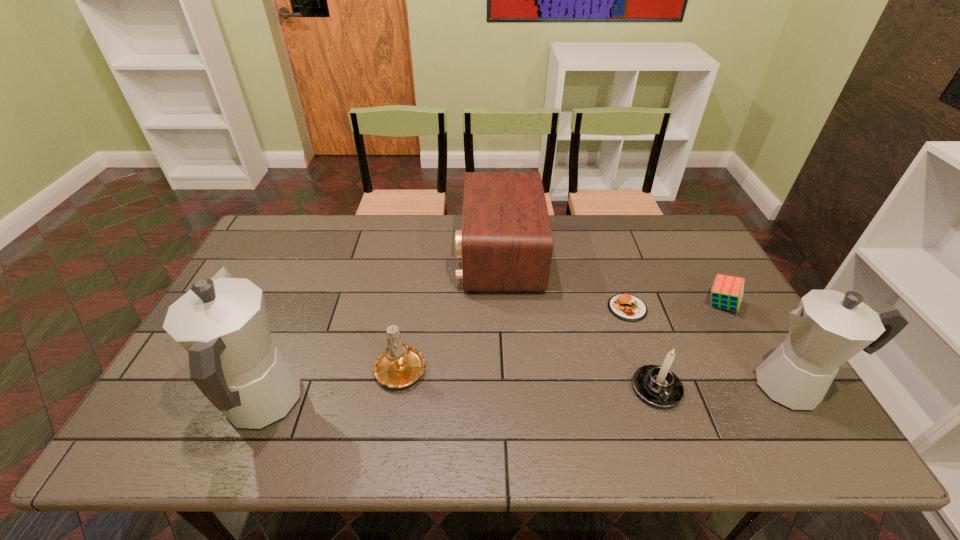
You are a GUI agent. You are given a task and a screenshot of the screen. Output one action in this format:
    pyautogui.click(x=<x>, y=<y>)
    Task: Click on the blank region between the candle holder and the sixth shortest object
    
    Given the screenshot: What is the action you would take?
    pyautogui.click(x=725, y=387)

Locate an element on the screen. The height and width of the screenshot is (540, 960). free spot between the shorter coffeepot and the candle holder is located at coordinates (725, 387).

Choose which object is the nearest neighbor to the shortest object. Please provide its 2D coordinates. Your answer should be formatted as a tuple, i.e. [(x, y)], where the tuple contains the x and y coordinates of a point satisfying the conditions above.

[(657, 385)]

Identify which object is located as the fourth nearest to the fifth object from right to left. Please provide its 2D coordinates. Your answer should be formatted as a tuple, i.e. [(x, y)], where the tuple contains the x and y coordinates of a point satisfying the conditions above.

[(222, 322)]

Find the location of a particular element. free space that satisfies the following two spatial constraints: 1. on the front panel of the fifth object from right to left; 2. on the right side of the right coffeepot is located at coordinates (506, 386).

The image size is (960, 540). What are the coordinates of `vacant region that satisfies the following two spatial constraints: 1. on the front panel of the patty (food); 2. on the left side of the third object from left to right` in the screenshot? It's located at (502, 308).

Locate an element on the screen. This screenshot has height=540, width=960. vacant position in the image that satisfies the following two spatial constraints: 1. on the back side of the left coffeepot; 2. on the right side of the cube is located at coordinates (303, 305).

At what (x,y) coordinates should I click in order to perform the action: click on free space that satisfies the following two spatial constraints: 1. on the front panel of the third tallest object; 2. on the back side of the sixth shortest object. Please return your answer as a coordinate pair (x, y). Looking at the image, I should click on (506, 386).

This screenshot has height=540, width=960. Identify the location of free region that satisfies the following two spatial constraints: 1. on the back side of the sixth tallest object; 2. on the left side of the patty (food). (626, 305).

Find the location of `vacant space that satisfies the following two spatial constraints: 1. on the back side of the taller coffeepot; 2. on the left side of the candle`. vacant space that satisfies the following two spatial constraints: 1. on the back side of the taller coffeepot; 2. on the left side of the candle is located at coordinates (277, 367).